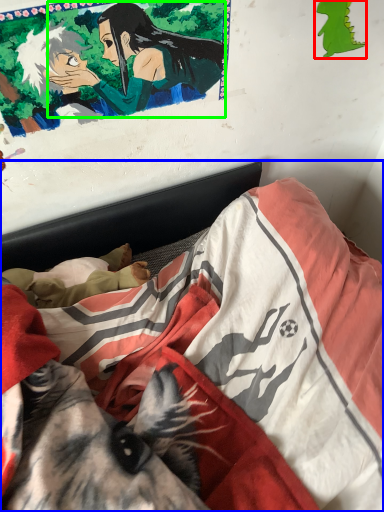
Question: Based on their relative distances, which object is nearer to art (highlighted by a red box)? Choose from bed (highlighted by a blue box) and woman (highlighted by a green box).

Choices:
 (A) bed
 (B) woman

Answer: (B)